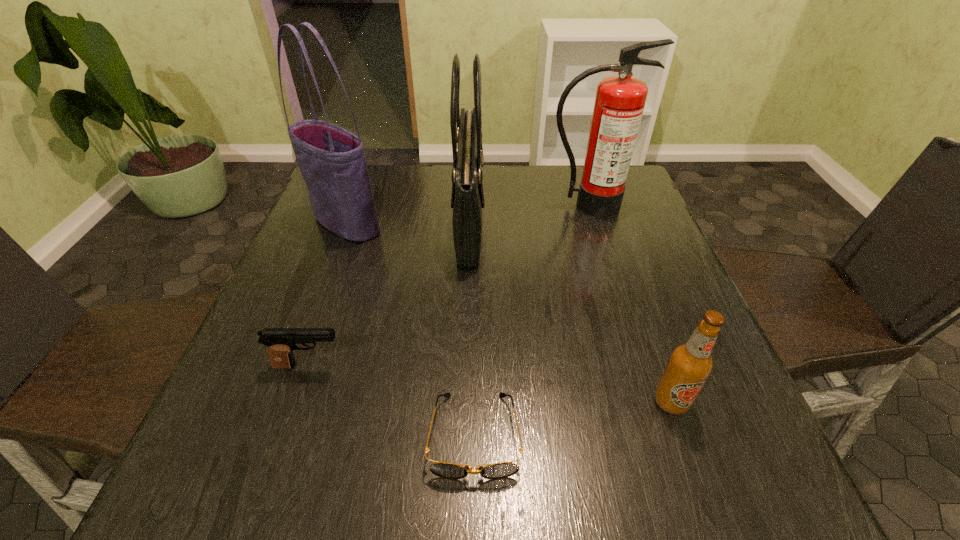
Locate an element on the screen. The width and height of the screenshot is (960, 540). free spot between the second shortest object and the beer bottle is located at coordinates (490, 383).

At what (x,y) coordinates should I click in order to perform the action: click on vacant region between the beer bottle and the shortest object. Please return your answer as a coordinate pair (x, y). Image resolution: width=960 pixels, height=540 pixels. Looking at the image, I should click on (573, 418).

The height and width of the screenshot is (540, 960). I want to click on vacant region between the fourth farthest object and the handbag, so click(389, 294).

Where is `free point between the fourth tallest object and the tote bag`? free point between the fourth tallest object and the tote bag is located at coordinates (509, 312).

Where is `blank region between the handbag and the fire extinguisher`? Image resolution: width=960 pixels, height=540 pixels. blank region between the handbag and the fire extinguisher is located at coordinates (529, 213).

Where is `free area in between the tote bag and the shortest object`? The width and height of the screenshot is (960, 540). free area in between the tote bag and the shortest object is located at coordinates [411, 329].

The height and width of the screenshot is (540, 960). In order to click on free space between the fire extinguisher and the handbag in this screenshot , I will do `click(529, 213)`.

Where is `blank region between the shortest object and the fire extinguisher`? blank region between the shortest object and the fire extinguisher is located at coordinates (531, 320).

Image resolution: width=960 pixels, height=540 pixels. Identify the location of free area in between the pistol and the shortest object. (392, 401).

The height and width of the screenshot is (540, 960). I want to click on empty space that is in between the beer bottle and the pistol, so click(490, 383).